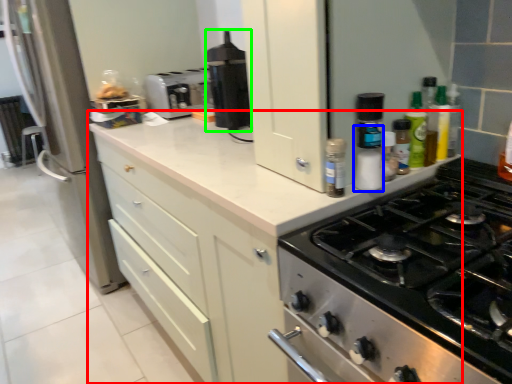
Question: Which object is the closest to the cabinetry (highlighted by a red box)? Choose among these: bottle (highlighted by a blue box) or kitchen appliance (highlighted by a green box).

Choices:
 (A) bottle
 (B) kitchen appliance

Answer: (B)